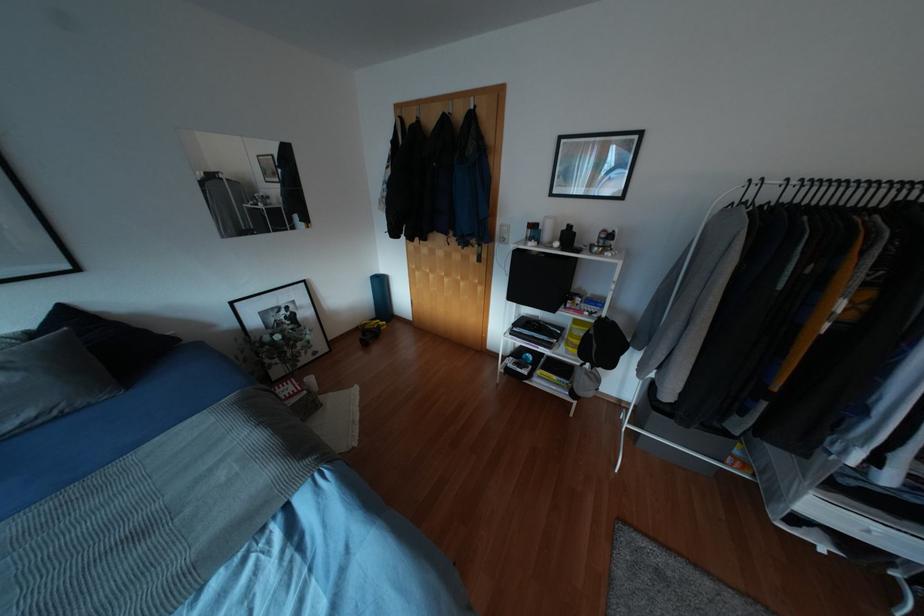
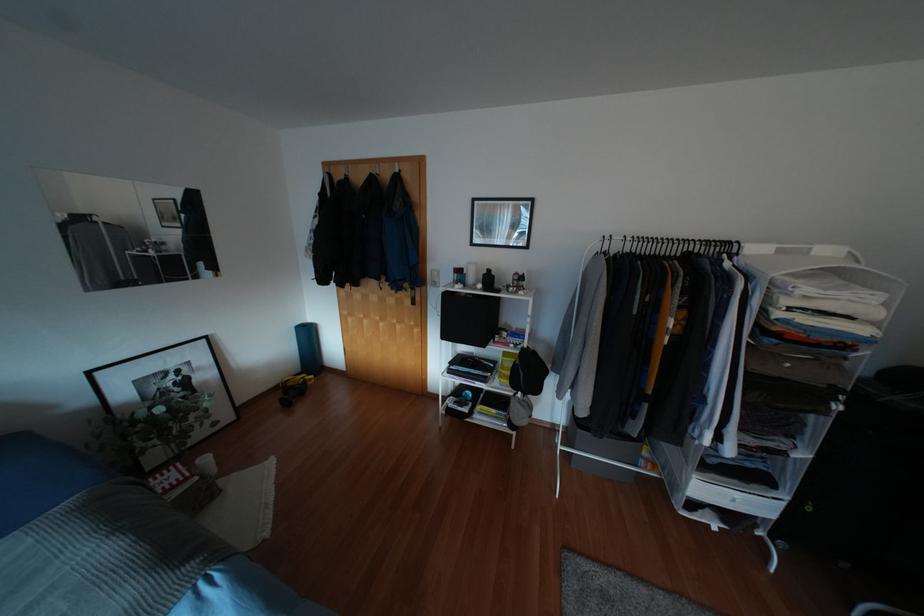
Based on the photo, what movement of the cameraman would produce the second image?

The movement direction of the cameraman is right, backward.